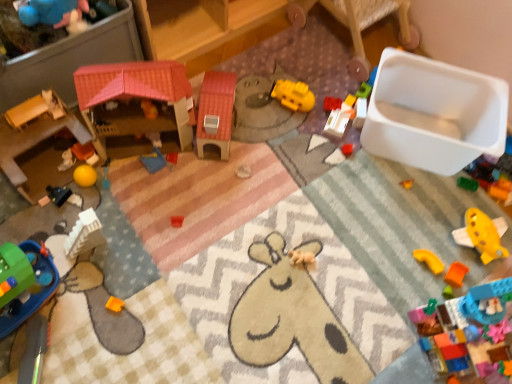
In order to click on vacant space to the right of smooth wooden dollhouse at left, the 1th toy in the left-to-right sequence in this screenshot , I will do `click(117, 194)`.